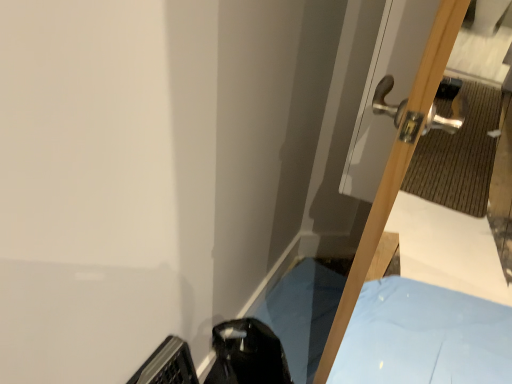
I want to click on metallic silver door at upper right, so click(x=394, y=177).

Describe the element at coordinates (394, 177) in the screenshot. I see `metallic silver door at upper right` at that location.

At what (x,y) coordinates should I click in order to perform the action: click on metallic silver door at upper right. Please return your answer as a coordinate pair (x, y). The height and width of the screenshot is (384, 512). Looking at the image, I should click on (394, 177).